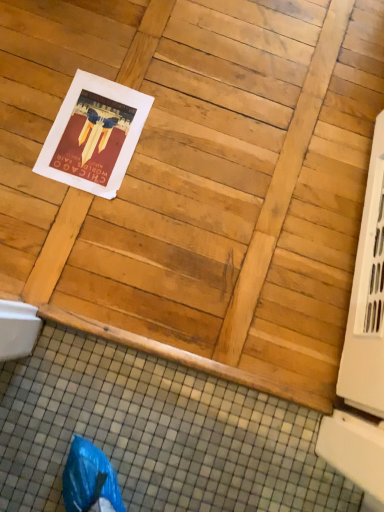
The height and width of the screenshot is (512, 384). Find the location of `free area behind white paper poster at upper left`. free area behind white paper poster at upper left is located at coordinates (132, 62).